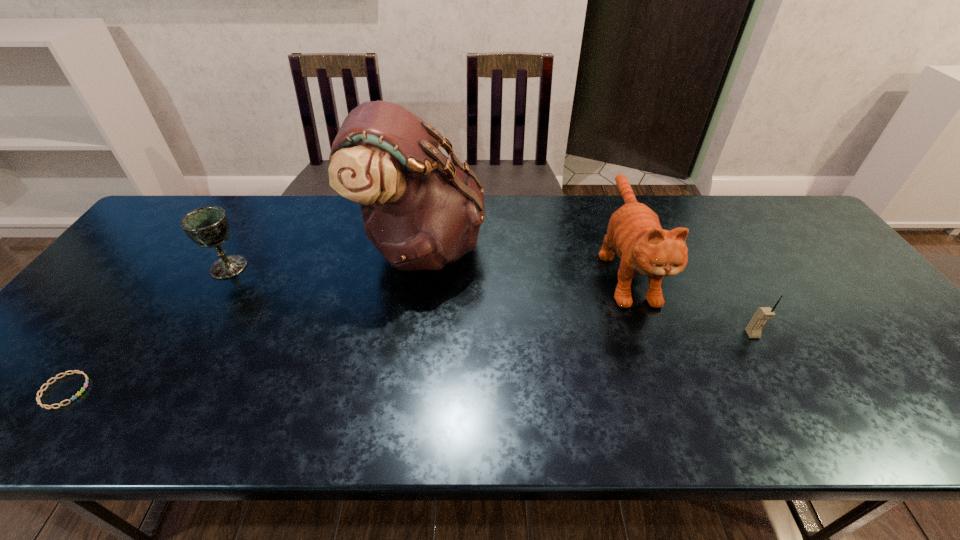
At what (x,y) coordinates should I click in order to perform the action: click on vacant space located at the front of the tallest object with buckles. Please return your answer as a coordinate pair (x, y). Looking at the image, I should click on (x=559, y=246).

Image resolution: width=960 pixels, height=540 pixels. I want to click on vacant space located on the face of the fourth shortest object, so click(x=661, y=368).

Image resolution: width=960 pixels, height=540 pixels. Find the location of `free location located 0.120m on the left of the second object from left to right`. free location located 0.120m on the left of the second object from left to right is located at coordinates (167, 267).

This screenshot has width=960, height=540. Identify the location of vacant space located 0.050m on the front of the fourth farthest object, where the keypad is located. (764, 356).

Where is `vacant space situated on the surface of the shortest object showing star-shaped elements`? This screenshot has width=960, height=540. vacant space situated on the surface of the shortest object showing star-shaped elements is located at coordinates (128, 390).

This screenshot has height=540, width=960. I want to click on satchel positioned at the far edge, so click(x=421, y=210).

The image size is (960, 540). I want to click on cat situated at the far edge, so click(634, 230).

Find the location of a particular element. object that is at the near edge is located at coordinates (78, 372).

Find the location of a particular element. This screenshot has width=960, height=540. object present at the left edge is located at coordinates (78, 372).

Where is `object located in the near left corner section of the desktop`? This screenshot has height=540, width=960. object located in the near left corner section of the desktop is located at coordinates (78, 372).